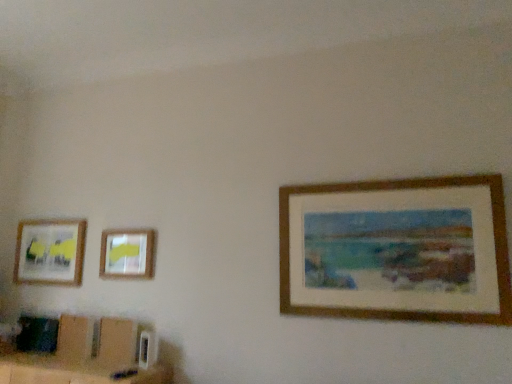
Question: Can you confirm if matte plastic picture frame at upper left, positioned as the second picture frame in front-to-back order, is thinner than matte wooden picture frame at left, the 1th picture frame when ordered from left to right?

Choices:
 (A) no
 (B) yes

Answer: (B)

Question: Considering the relative sizes of matte plastic picture frame at upper left, placed as the second picture frame when sorted from back to front, and matte wooden picture frame at left, acting as the third picture frame starting from the right, in the image provided, is matte plastic picture frame at upper left, placed as the second picture frame when sorted from back to front, taller than matte wooden picture frame at left, acting as the third picture frame starting from the right,?

Choices:
 (A) no
 (B) yes

Answer: (A)

Question: Does matte plastic picture frame at upper left, which is counted as the second picture frame, starting from the left, appear on the left side of matte wooden picture frame at left, the first picture frame positioned from the back?

Choices:
 (A) no
 (B) yes

Answer: (A)

Question: From the image's perspective, is matte plastic picture frame at upper left, arranged as the 2th picture frame when viewed from the right, above matte wooden picture frame at left, the 1th picture frame when ordered from left to right?

Choices:
 (A) no
 (B) yes

Answer: (B)

Question: Is matte plastic picture frame at upper left, positioned as the second picture frame in front-to-back order, to the right of matte wooden picture frame at left, the first picture frame positioned from the back, from the viewer's perspective?

Choices:
 (A) yes
 (B) no

Answer: (A)

Question: Does matte plastic picture frame at upper left, positioned as the second picture frame in front-to-back order, come in front of matte wooden picture frame at left, the first picture frame positioned from the back?

Choices:
 (A) no
 (B) yes

Answer: (B)

Question: Is matte wooden picture frame at left, the 1th picture frame when ordered from left to right, a part of wooden picture frame at right, positioned as the first picture frame in front-to-back order?

Choices:
 (A) no
 (B) yes

Answer: (A)

Question: Can you confirm if wooden picture frame at right, the third picture frame positioned from the left, is wider than matte wooden picture frame at left, the first picture frame positioned from the back?

Choices:
 (A) no
 (B) yes

Answer: (B)

Question: Does wooden picture frame at right, positioned as the first picture frame in front-to-back order, have a lesser width compared to matte wooden picture frame at left, acting as the third picture frame starting from the right?

Choices:
 (A) no
 (B) yes

Answer: (A)

Question: Is wooden picture frame at right, positioned as the first picture frame in front-to-back order, taller than matte wooden picture frame at left, the 1th picture frame when ordered from left to right?

Choices:
 (A) yes
 (B) no

Answer: (A)

Question: Considering the relative sizes of wooden picture frame at right, the third picture frame positioned from the left, and matte wooden picture frame at left, which is the third picture frame from front to back, in the image provided, is wooden picture frame at right, the third picture frame positioned from the left, smaller than matte wooden picture frame at left, which is the third picture frame from front to back,?

Choices:
 (A) yes
 (B) no

Answer: (B)

Question: Does wooden picture frame at right, positioned as the first picture frame in front-to-back order, have a lesser height compared to matte wooden picture frame at left, acting as the third picture frame starting from the right?

Choices:
 (A) yes
 (B) no

Answer: (B)

Question: From the image's perspective, is matte plastic picture frame at upper left, placed as the second picture frame when sorted from back to front, located beneath wooden picture frame at right, which ranks as the 3th picture frame in back-to-front order?

Choices:
 (A) yes
 (B) no

Answer: (A)